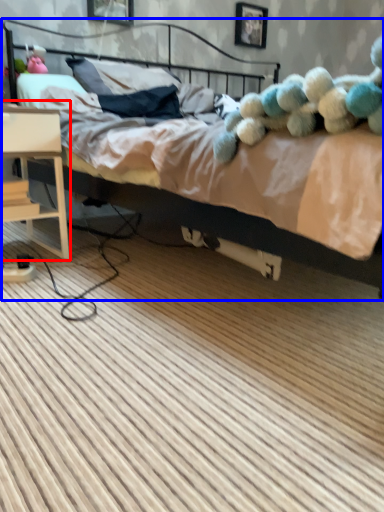
Question: Which of the following is the closest to the observer, nightstand (highlighted by a red box) or bed (highlighted by a blue box)?

Choices:
 (A) nightstand
 (B) bed

Answer: (B)